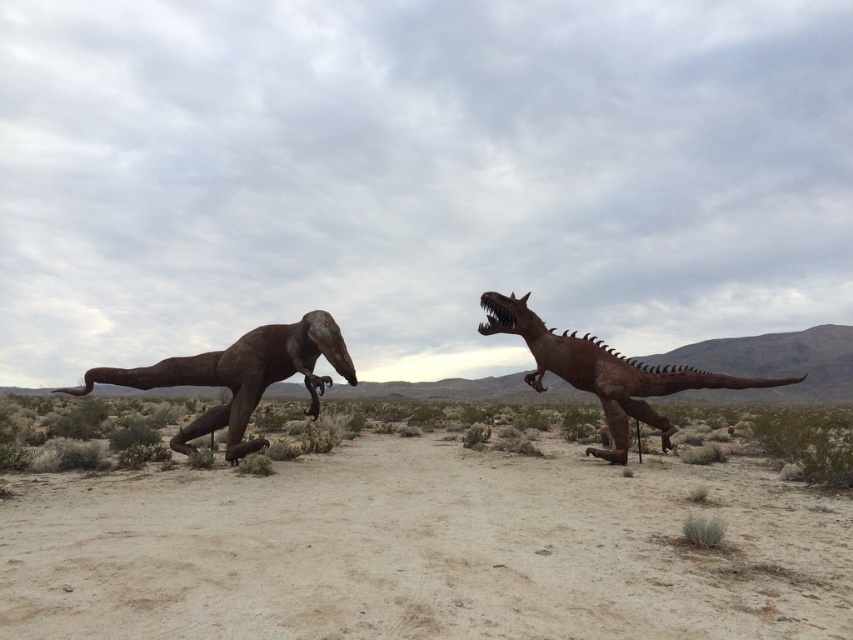
Question: Which of the following is the closest to the observer?

Choices:
 (A) rusty metal dinosaur at right
 (B) rusty metal dinosaur at left

Answer: (B)

Question: Which object is the closest to the rusty metal dinosaur at left?

Choices:
 (A) rusty metal dinosaur at right
 (B) dirt field at center

Answer: (B)

Question: Does dirt field at center lie behind rusty metal dinosaur at right?

Choices:
 (A) no
 (B) yes

Answer: (A)

Question: Which of these objects is positioned closest to the dirt field at center?

Choices:
 (A) rusty metal dinosaur at right
 (B) rusty metal dinosaur at left

Answer: (B)

Question: Is dirt field at center to the left of rusty metal dinosaur at right from the viewer's perspective?

Choices:
 (A) yes
 (B) no

Answer: (A)

Question: Does rusty metal dinosaur at left appear on the left side of rusty metal dinosaur at right?

Choices:
 (A) no
 (B) yes

Answer: (B)